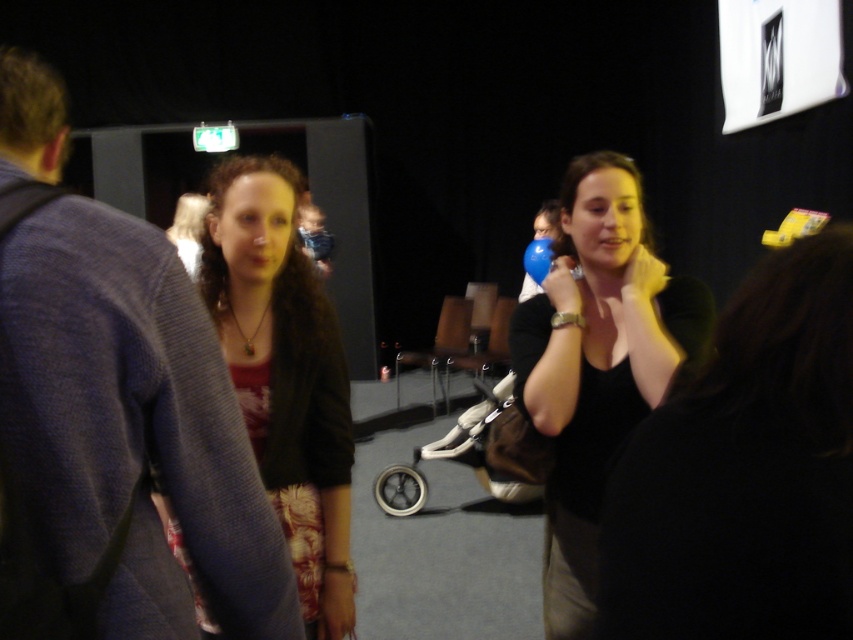
Can you confirm if dark blue sweater at left is positioned above matte black shirt at center?

Indeed, dark blue sweater at left is positioned over matte black shirt at center.

Is point (21, 74) in front of point (654, 388)?

That is True.

Who is more distant from viewer, (94,268) or (666,333)?

The point (666,333) is behind.

Where is `dark blue sweater at left`? This screenshot has width=853, height=640. dark blue sweater at left is located at coordinates (114, 413).

Who is shorter, dark blue sweater at left or matte black jacket at center?

dark blue sweater at left is shorter.

Image resolution: width=853 pixels, height=640 pixels. What do you see at coordinates (114, 413) in the screenshot?
I see `dark blue sweater at left` at bounding box center [114, 413].

This screenshot has width=853, height=640. I want to click on dark blue sweater at left, so click(x=114, y=413).

Which is below, matte black shirt at center or matte black jacket at center?

Positioned lower is matte black shirt at center.

Is matte black shirt at center to the right of matte black jacket at center from the viewer's perspective?

Indeed, matte black shirt at center is positioned on the right side of matte black jacket at center.

Which is behind, point (651, 266) or point (230, 365)?

The point (651, 266) is more distant.

Where is `matte black shirt at center`? This screenshot has height=640, width=853. matte black shirt at center is located at coordinates (596, 364).